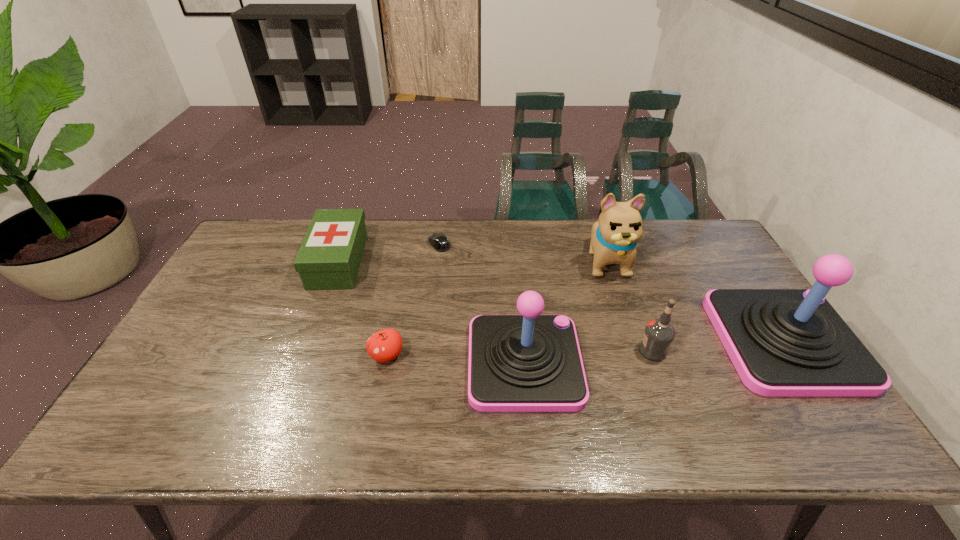
Where is `the shorter joystick`? The image size is (960, 540). the shorter joystick is located at coordinates (530, 362).

The width and height of the screenshot is (960, 540). In order to click on the left joystick in this screenshot , I will do `click(530, 362)`.

In order to click on the taller joystick in this screenshot , I will do `click(782, 342)`.

The height and width of the screenshot is (540, 960). I want to click on the rightmost object, so click(782, 342).

Find the location of a particular element. Image resolution: width=960 pixels, height=540 pixels. the first-aid kit is located at coordinates (329, 257).

At what (x,y) coordinates should I click in order to perform the action: click on the leftmost object. Please return your answer as a coordinate pair (x, y). Looking at the image, I should click on (329, 257).

Where is `the third object from left to right`? The width and height of the screenshot is (960, 540). the third object from left to right is located at coordinates (439, 241).

This screenshot has width=960, height=540. Find the location of `mouse`. mouse is located at coordinates (439, 241).

Locate an element on the screen. puppy is located at coordinates (614, 237).

Image resolution: width=960 pixels, height=540 pixels. Identify the location of apple. (385, 345).